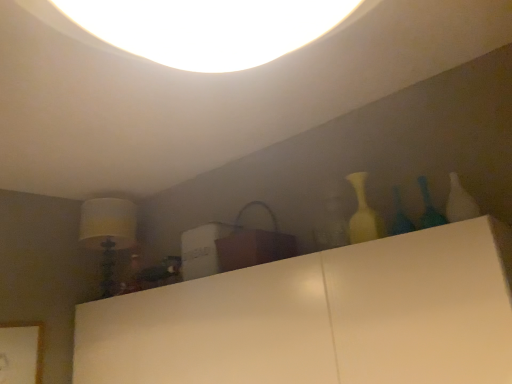
Identify the location of translucent glass vase at right, positioned as the 1th glass vase in right-to-left order. Image resolution: width=512 pixels, height=384 pixels. (x=429, y=207).

Measure the distance between translucent glass vase at right, placed as the 2th glass vase when sorted from left to right, and camera.

translucent glass vase at right, placed as the 2th glass vase when sorted from left to right, is 1.56 meters away from camera.

The height and width of the screenshot is (384, 512). What do you see at coordinates (108, 233) in the screenshot?
I see `white fabric lampshade at left` at bounding box center [108, 233].

Identify the location of translucent glass vase at upper right, marked as the second glass vase in a right-to-left arrangement. The height and width of the screenshot is (384, 512). (400, 216).

Measure the distance between white fabric lampshade at left and translucent glass vase at right, positioned as the 1th glass vase in right-to-left order.

white fabric lampshade at left and translucent glass vase at right, positioned as the 1th glass vase in right-to-left order, are 6.59 feet apart from each other.

Considering the sizes of white fabric lampshade at left and translucent glass vase at right, positioned as the 1th glass vase in right-to-left order, in the image, is white fabric lampshade at left bigger or smaller than translucent glass vase at right, positioned as the 1th glass vase in right-to-left order,?

Clearly, white fabric lampshade at left is larger in size than translucent glass vase at right, positioned as the 1th glass vase in right-to-left order.

Could translucent glass vase at right, positioned as the 1th glass vase in right-to-left order, be considered to be inside white fabric lampshade at left?

No, translucent glass vase at right, positioned as the 1th glass vase in right-to-left order, is not a part of white fabric lampshade at left.

From a real-world perspective, is white fabric lampshade at left positioned above or below translucent glass vase at right, placed as the 2th glass vase when sorted from left to right?

In terms of real-world spatial position, white fabric lampshade at left is above translucent glass vase at right, placed as the 2th glass vase when sorted from left to right.

From the image's perspective, does white fabric lampshade at left appear higher than translucent glass vase at upper right, marked as the second glass vase in a right-to-left arrangement?

Actually, white fabric lampshade at left appears below translucent glass vase at upper right, marked as the second glass vase in a right-to-left arrangement, in the image.

Which is less distant, (111, 244) or (413, 230)?

Clearly, point (111, 244) is more distant from the camera than point (413, 230).

You are a GUI agent. You are given a task and a screenshot of the screen. Output one action in this format:
    pyautogui.click(x=<x>, y=<y>)
    Task: Click on the glass vase that is the 1st object located in front of the white fabric lampshade at left
    The image size is (512, 384).
    Given the screenshot: What is the action you would take?
    pyautogui.click(x=400, y=216)

From a real-world perspective, is white fabric lampshade at left physically located above or below translucent glass vase at upper right, which is the first glass vase in left-to-right order?

From a real-world perspective, white fabric lampshade at left is physically above translucent glass vase at upper right, which is the first glass vase in left-to-right order.

From the image's perspective, relative to white fabric lampshade at left, is matte white vase at right above or below?

matte white vase at right is situated higher than white fabric lampshade at left in the image.

Does matte white vase at right have a lesser height compared to white fabric lampshade at left?

Indeed, matte white vase at right has a lesser height compared to white fabric lampshade at left.

Between point (353, 173) and point (105, 271), which one is positioned behind?

The point (105, 271) is farther from the camera.

Between matte white vase at right and white fabric lampshade at left, which one has smaller width?

matte white vase at right.

How distant is translucent glass vase at upper right, which is the first glass vase in left-to-right order, from matte white vase at right?

translucent glass vase at upper right, which is the first glass vase in left-to-right order, and matte white vase at right are 4.69 inches apart from each other.

Considering the points (397, 229) and (370, 237), which point is in front, point (397, 229) or point (370, 237)?

The point (370, 237) is closer to the camera.

From a real-world perspective, which is physically above, translucent glass vase at upper right, marked as the second glass vase in a right-to-left arrangement, or matte white vase at right?

matte white vase at right, from a real-world perspective.

Are translucent glass vase at upper right, which is the first glass vase in left-to-right order, and matte white vase at right making contact?

No, translucent glass vase at upper right, which is the first glass vase in left-to-right order, is not making contact with matte white vase at right.

Who is smaller, translucent glass vase at right, placed as the 2th glass vase when sorted from left to right, or translucent glass vase at upper right, which is the first glass vase in left-to-right order?

translucent glass vase at right, placed as the 2th glass vase when sorted from left to right, is smaller.

From a real-world perspective, which object rests below the other?

translucent glass vase at upper right, which is the first glass vase in left-to-right order, from a real-world perspective.

Looking at their sizes, would you say translucent glass vase at right, placed as the 2th glass vase when sorted from left to right, is wider or thinner than translucent glass vase at upper right, marked as the second glass vase in a right-to-left arrangement?

In the image, translucent glass vase at right, placed as the 2th glass vase when sorted from left to right, appears to be more narrow than translucent glass vase at upper right, marked as the second glass vase in a right-to-left arrangement.

Can we say translucent glass vase at right, placed as the 2th glass vase when sorted from left to right, lies outside translucent glass vase at upper right, which is the first glass vase in left-to-right order?

Yes, translucent glass vase at right, placed as the 2th glass vase when sorted from left to right, is not within translucent glass vase at upper right, which is the first glass vase in left-to-right order.

From a real-world perspective, which is physically below, matte white vase at right or translucent glass vase at right, placed as the 2th glass vase when sorted from left to right?

translucent glass vase at right, placed as the 2th glass vase when sorted from left to right, from a real-world perspective.

Between matte white vase at right and translucent glass vase at right, positioned as the 1th glass vase in right-to-left order, which one has larger width?

matte white vase at right.

Is there a large distance between matte white vase at right and translucent glass vase at right, positioned as the 1th glass vase in right-to-left order?

No, matte white vase at right is in close proximity to translucent glass vase at right, positioned as the 1th glass vase in right-to-left order.

Relative to translucent glass vase at right, placed as the 2th glass vase when sorted from left to right, is matte white vase at right in front or behind?

matte white vase at right is behind translucent glass vase at right, placed as the 2th glass vase when sorted from left to right.

At what (x,y) coordinates should I click in order to perform the action: click on lamp above the translucent glass vase at right, placed as the 2th glass vase when sorted from left to right (from a real-world perspective). Please return your answer as a coordinate pair (x, y). This screenshot has width=512, height=384. Looking at the image, I should click on (108, 233).

Is there a large distance between translucent glass vase at right, positioned as the 1th glass vase in right-to-left order, and white fabric lampshade at left?

Yes.

Is white fabric lampshade at left inside translucent glass vase at right, placed as the 2th glass vase when sorted from left to right?

No, white fabric lampshade at left is located outside of translucent glass vase at right, placed as the 2th glass vase when sorted from left to right.

In terms of height, does translucent glass vase at right, placed as the 2th glass vase when sorted from left to right, look taller or shorter compared to white fabric lampshade at left?

Clearly, translucent glass vase at right, placed as the 2th glass vase when sorted from left to right, is shorter compared to white fabric lampshade at left.

I want to click on the 2nd glass vase counting from the right of the white fabric lampshade at left, so 429,207.

Where is `lamp below the translucent glass vase at upper right, marked as the second glass vase in a right-to-left arrangement (from the image's perspective)`? lamp below the translucent glass vase at upper right, marked as the second glass vase in a right-to-left arrangement (from the image's perspective) is located at coordinates (108, 233).

Based on their spatial positions, is translucent glass vase at upper right, which is the first glass vase in left-to-right order, or matte white vase at right closer to white fabric lampshade at left?

Among the two, matte white vase at right is located nearer to white fabric lampshade at left.

Considering their positions, is translucent glass vase at upper right, marked as the second glass vase in a right-to-left arrangement, positioned further to white fabric lampshade at left than translucent glass vase at right, positioned as the 1th glass vase in right-to-left order?

translucent glass vase at right, positioned as the 1th glass vase in right-to-left order, lies further to white fabric lampshade at left than the other object.

Estimate the real-world distances between objects in this image. Which object is closer to translucent glass vase at upper right, marked as the second glass vase in a right-to-left arrangement, matte white vase at right or white fabric lampshade at left?

matte white vase at right is positioned closer to the anchor translucent glass vase at upper right, marked as the second glass vase in a right-to-left arrangement.

Estimate the real-world distances between objects in this image. Which object is further from translucent glass vase at upper right, which is the first glass vase in left-to-right order, white fabric lampshade at left or translucent glass vase at right, positioned as the 1th glass vase in right-to-left order?

The object further to translucent glass vase at upper right, which is the first glass vase in left-to-right order, is white fabric lampshade at left.

Considering their positions, is white fabric lampshade at left positioned closer to translucent glass vase at right, placed as the 2th glass vase when sorted from left to right, than matte white vase at right?

matte white vase at right is closer to translucent glass vase at right, placed as the 2th glass vase when sorted from left to right.

Considering their positions, is translucent glass vase at right, placed as the 2th glass vase when sorted from left to right, positioned further to translucent glass vase at upper right, marked as the second glass vase in a right-to-left arrangement, than matte white vase at right?

Based on the image, translucent glass vase at right, placed as the 2th glass vase when sorted from left to right, appears to be further to translucent glass vase at upper right, marked as the second glass vase in a right-to-left arrangement.

In the scene shown: When comparing their distances from translucent glass vase at right, positioned as the 1th glass vase in right-to-left order, does translucent glass vase at upper right, marked as the second glass vase in a right-to-left arrangement, or matte white vase at right seem closer?

Based on the image, translucent glass vase at upper right, marked as the second glass vase in a right-to-left arrangement, appears to be nearer to translucent glass vase at right, positioned as the 1th glass vase in right-to-left order.

In the scene shown: Which object lies nearer to the anchor point matte white vase at right, translucent glass vase at right, placed as the 2th glass vase when sorted from left to right, or white fabric lampshade at left?

Among the two, translucent glass vase at right, placed as the 2th glass vase when sorted from left to right, is located nearer to matte white vase at right.

Identify the location of bottle located between white fabric lampshade at left and translucent glass vase at right, positioned as the 1th glass vase in right-to-left order, in the left-right direction. The height and width of the screenshot is (384, 512). (362, 213).

Find the location of a particular element. The width and height of the screenshot is (512, 384). bottle between white fabric lampshade at left and translucent glass vase at upper right, which is the first glass vase in left-to-right order, in the horizontal direction is located at coordinates (362, 213).

This screenshot has width=512, height=384. Find the location of `glass vase between white fabric lampshade at left and translucent glass vase at right, placed as the 2th glass vase when sorted from left to right, from left to right`. glass vase between white fabric lampshade at left and translucent glass vase at right, placed as the 2th glass vase when sorted from left to right, from left to right is located at coordinates (400, 216).

Image resolution: width=512 pixels, height=384 pixels. Find the location of `glass vase between matte white vase at right and translucent glass vase at right, positioned as the 1th glass vase in right-to-left order`. glass vase between matte white vase at right and translucent glass vase at right, positioned as the 1th glass vase in right-to-left order is located at coordinates (400, 216).